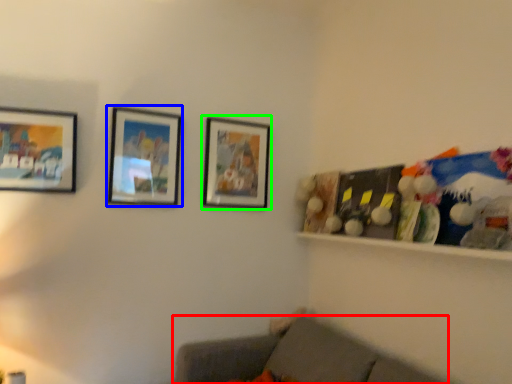
Question: Which object is the closest to the studio couch (highlighted by a red box)? Choose among these: picture frame (highlighted by a blue box) or picture frame (highlighted by a green box).

Choices:
 (A) picture frame
 (B) picture frame

Answer: (B)